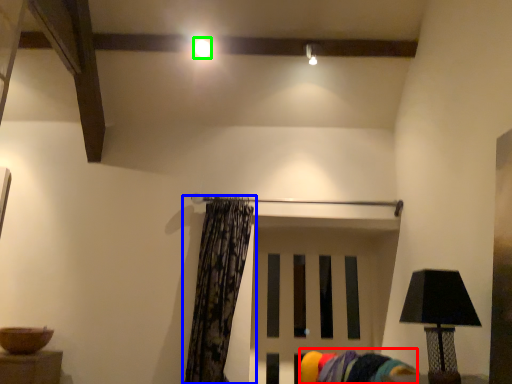
Question: Which is nearer to the swivel chair (highlighted by a red box)? curtain (highlighted by a blue box) or lighting (highlighted by a green box).

Choices:
 (A) curtain
 (B) lighting

Answer: (A)